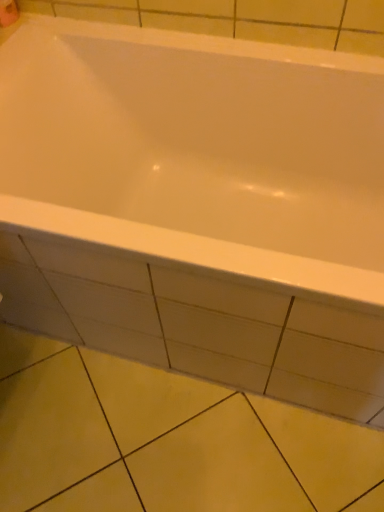
Question: Is white paper at upper left further to camera compared to white glossy bathtub at center?

Choices:
 (A) yes
 (B) no

Answer: (A)

Question: Would you consider white paper at upper left to be distant from white glossy bathtub at center?

Choices:
 (A) no
 (B) yes

Answer: (A)

Question: Considering the relative sizes of white paper at upper left and white glossy bathtub at center in the image provided, is white paper at upper left shorter than white glossy bathtub at center?

Choices:
 (A) no
 (B) yes

Answer: (B)

Question: Does white paper at upper left have a smaller size compared to white glossy bathtub at center?

Choices:
 (A) no
 (B) yes

Answer: (B)

Question: Is white paper at upper left closer to the viewer compared to white glossy bathtub at center?

Choices:
 (A) no
 (B) yes

Answer: (A)

Question: From a real-world perspective, is yellow matte tile at lower center positioned above or below white glossy bathtub at center?

Choices:
 (A) below
 (B) above

Answer: (A)

Question: Looking at their shapes, would you say yellow matte tile at lower center is wider or thinner than white glossy bathtub at center?

Choices:
 (A) thin
 (B) wide

Answer: (A)

Question: Relative to white glossy bathtub at center, is yellow matte tile at lower center in front or behind?

Choices:
 (A) front
 (B) behind

Answer: (B)

Question: Would you say yellow matte tile at lower center is to the left or to the right of white glossy bathtub at center in the picture?

Choices:
 (A) right
 (B) left

Answer: (B)

Question: Does point (264, 274) appear closer or farther from the camera than point (3, 10)?

Choices:
 (A) farther
 (B) closer

Answer: (B)

Question: Is white glossy bathtub at center wider or thinner than white paper at upper left?

Choices:
 (A) thin
 (B) wide

Answer: (B)

Question: Looking at the image, does white glossy bathtub at center seem bigger or smaller compared to white paper at upper left?

Choices:
 (A) big
 (B) small

Answer: (A)

Question: From the image's perspective, is white glossy bathtub at center positioned above or below white paper at upper left?

Choices:
 (A) above
 (B) below

Answer: (B)

Question: From the image's perspective, is white paper at upper left above or below yellow matte tile at lower center?

Choices:
 (A) below
 (B) above

Answer: (B)

Question: From a real-world perspective, relative to yellow matte tile at lower center, is white paper at upper left vertically above or below?

Choices:
 (A) above
 (B) below

Answer: (A)